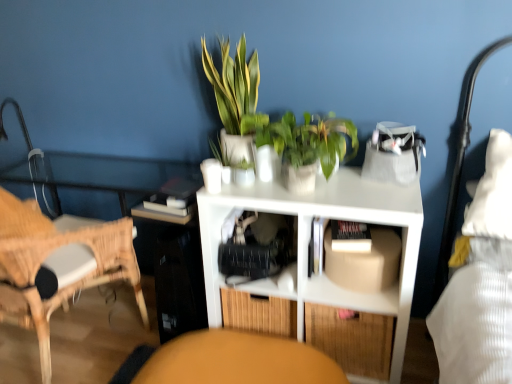
Question: In which direction should I rotate to look at white matte shelf at center, positioned as the first shelf in bottom-to-top order?

Choices:
 (A) right
 (B) left

Answer: (A)

Question: Is white matte book at center oriented away from green glossy plant at center, the first houseplant in the right-to-left sequence?

Choices:
 (A) yes
 (B) no

Answer: (B)

Question: Can you confirm if white matte book at center is bigger than green glossy plant at center, the first houseplant in the right-to-left sequence?

Choices:
 (A) no
 (B) yes

Answer: (A)

Question: Is the position of white matte book at center more distant than that of green glossy plant at center, acting as the 2th houseplant starting from the left?

Choices:
 (A) yes
 (B) no

Answer: (A)

Question: Is white matte book at center positioned before green glossy plant at center, acting as the 2th houseplant starting from the left?

Choices:
 (A) no
 (B) yes

Answer: (A)

Question: Does white matte book at center have a smaller size compared to green glossy plant at center, the first houseplant in the right-to-left sequence?

Choices:
 (A) no
 (B) yes

Answer: (B)

Question: Is white matte book at center to the left of green glossy plant at center, the first houseplant in the right-to-left sequence, from the viewer's perspective?

Choices:
 (A) yes
 (B) no

Answer: (B)

Question: Is green leafy plant at upper center, the 1th houseplant in the left-to-right sequence, beside white matte book at center?

Choices:
 (A) no
 (B) yes

Answer: (A)

Question: Is green leafy plant at upper center, marked as the 2th houseplant in a right-to-left arrangement, not close to white matte book at center?

Choices:
 (A) no
 (B) yes

Answer: (A)

Question: From a real-world perspective, is green leafy plant at upper center, marked as the 2th houseplant in a right-to-left arrangement, physically below white matte book at center?

Choices:
 (A) yes
 (B) no

Answer: (B)

Question: Considering the relative sizes of green leafy plant at upper center, marked as the 2th houseplant in a right-to-left arrangement, and white matte book at center in the image provided, is green leafy plant at upper center, marked as the 2th houseplant in a right-to-left arrangement, bigger than white matte book at center?

Choices:
 (A) no
 (B) yes

Answer: (B)

Question: Can you confirm if green leafy plant at upper center, marked as the 2th houseplant in a right-to-left arrangement, is thinner than white matte book at center?

Choices:
 (A) no
 (B) yes

Answer: (B)

Question: Considering the relative positions of green leafy plant at upper center, the 1th houseplant in the left-to-right sequence, and white matte book at center in the image provided, is green leafy plant at upper center, the 1th houseplant in the left-to-right sequence, to the left of white matte book at center from the viewer's perspective?

Choices:
 (A) yes
 (B) no

Answer: (A)

Question: Considering the relative sizes of white matte book at center and bamboo drawer at lower center in the image provided, is white matte book at center bigger than bamboo drawer at lower center?

Choices:
 (A) no
 (B) yes

Answer: (A)